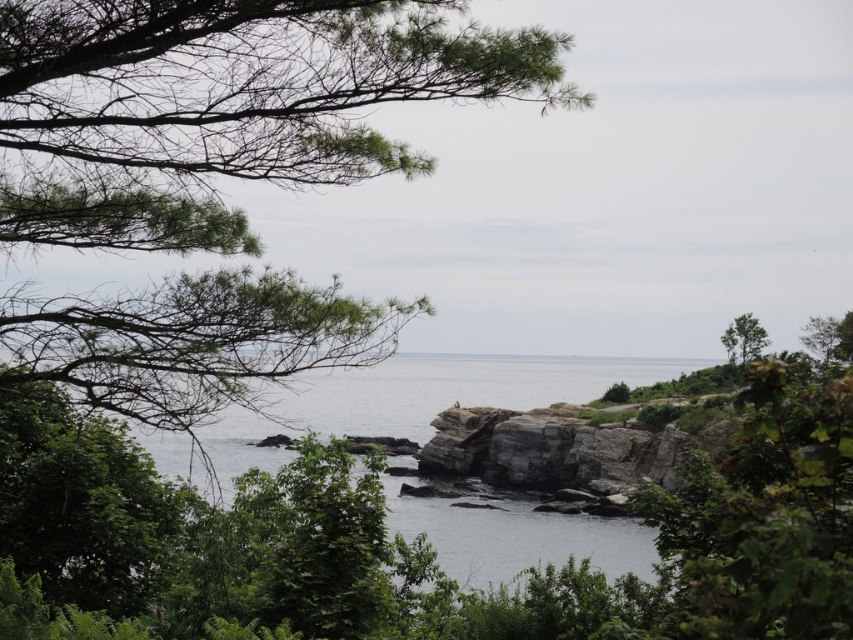
Can you confirm if green needle-like leaves at upper left is smaller than clear water at center?

Yes, green needle-like leaves at upper left is smaller than clear water at center.

Is green needle-like leaves at upper left shorter than clear water at center?

Yes.

Which is behind, point (242, 58) or point (350, 429)?

Point (350, 429)

This screenshot has height=640, width=853. What are the coordinates of `green needle-like leaves at upper left` in the screenshot? It's located at point(224,106).

Looking at this image, who is positioned more to the left, green needle-like leaves at upper left or green leafy tree at upper right?

From the viewer's perspective, green needle-like leaves at upper left appears more on the left side.

Between point (218, 385) and point (757, 333), which one is positioned in front?

Point (218, 385) is more forward.

In order to click on green needle-like leaves at upper left in this screenshot , I will do `click(224, 106)`.

Which is more to the left, clear water at center or green leafy tree at upper right?

clear water at center is more to the left.

Find the location of a particular element. The width and height of the screenshot is (853, 640). clear water at center is located at coordinates (392, 404).

Image resolution: width=853 pixels, height=640 pixels. I want to click on clear water at center, so click(392, 404).